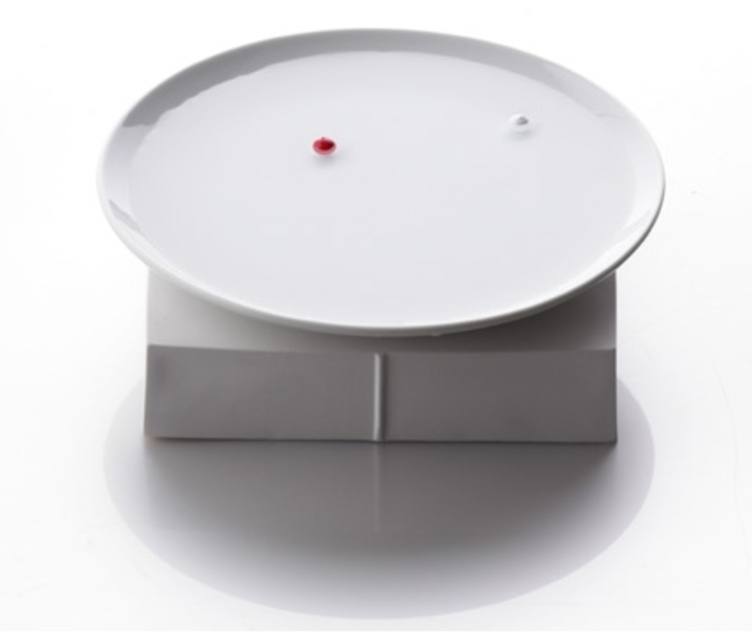
Is white glossy lid at center closer to the viewer compared to matte gray box at center?

Yes, it is in front of matte gray box at center.

Is white glossy lid at center smaller than matte gray box at center?

Actually, white glossy lid at center might be larger than matte gray box at center.

Is point (402, 38) farther from camera compared to point (176, 408)?

Yes, point (402, 38) is behind point (176, 408).

Locate an element on the screen. Image resolution: width=752 pixels, height=640 pixels. white glossy lid at center is located at coordinates (381, 180).